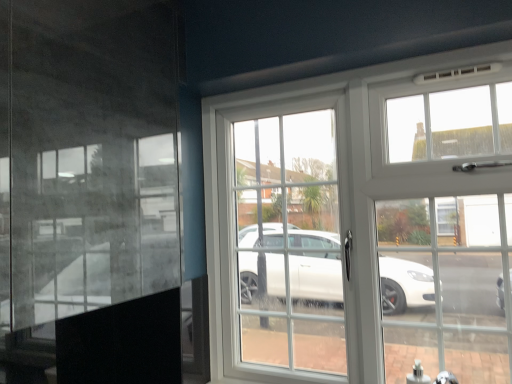
Question: Should I look upward or downward to see white plastic window at center?

Choices:
 (A) up
 (B) down

Answer: (B)